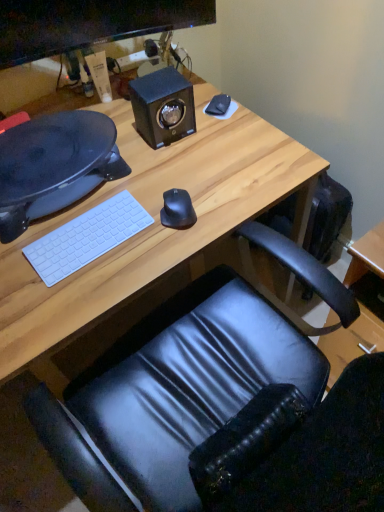
Where is `free space above wooden desk at center (from a real-world perspective)`? This screenshot has height=512, width=384. free space above wooden desk at center (from a real-world perspective) is located at coordinates (127, 191).